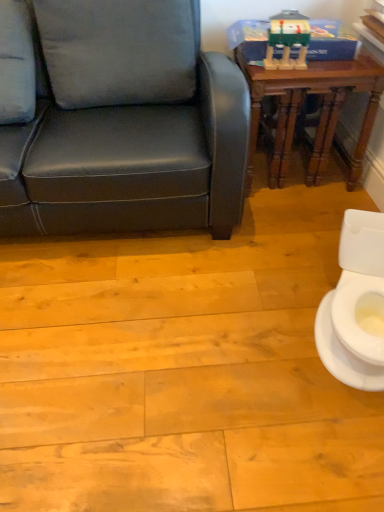
Question: Would you say wooden table at upper right contains white fabric pillow at upper left?

Choices:
 (A) no
 (B) yes

Answer: (A)

Question: Is wooden table at upper right bigger than white fabric pillow at upper left?

Choices:
 (A) yes
 (B) no

Answer: (A)

Question: From a real-world perspective, is wooden table at upper right located higher than white fabric pillow at upper left?

Choices:
 (A) yes
 (B) no

Answer: (B)

Question: Could you tell me if wooden table at upper right is facing white fabric pillow at upper left?

Choices:
 (A) no
 (B) yes

Answer: (A)

Question: From a real-world perspective, is wooden table at upper right located beneath white fabric pillow at upper left?

Choices:
 (A) no
 (B) yes

Answer: (B)

Question: From their relative heights in the image, would you say matte green plastic toy at upper right is taller or shorter than white fabric pillow at upper left?

Choices:
 (A) tall
 (B) short

Answer: (B)

Question: Choose the correct answer: Is matte green plastic toy at upper right inside white fabric pillow at upper left or outside it?

Choices:
 (A) outside
 (B) inside

Answer: (A)

Question: Considering the positions of point (268, 36) and point (4, 57), is point (268, 36) closer or farther from the camera than point (4, 57)?

Choices:
 (A) closer
 (B) farther

Answer: (B)

Question: From the image's perspective, is matte green plastic toy at upper right above or below white fabric pillow at upper left?

Choices:
 (A) below
 (B) above

Answer: (B)

Question: From a real-world perspective, is wooden table at upper right physically located above or below white glossy toilet at lower right?

Choices:
 (A) below
 (B) above

Answer: (B)

Question: In terms of width, does wooden table at upper right look wider or thinner when compared to white glossy toilet at lower right?

Choices:
 (A) wide
 (B) thin

Answer: (A)

Question: Would you say wooden table at upper right is inside or outside white glossy toilet at lower right?

Choices:
 (A) outside
 (B) inside

Answer: (A)

Question: Considering their positions, is wooden table at upper right located in front of or behind white glossy toilet at lower right?

Choices:
 (A) front
 (B) behind

Answer: (B)

Question: Choose the correct answer: Is white glossy toilet at lower right inside wooden table at upper right or outside it?

Choices:
 (A) inside
 (B) outside

Answer: (B)

Question: From the image's perspective, is white glossy toilet at lower right positioned above or below wooden table at upper right?

Choices:
 (A) above
 (B) below

Answer: (B)